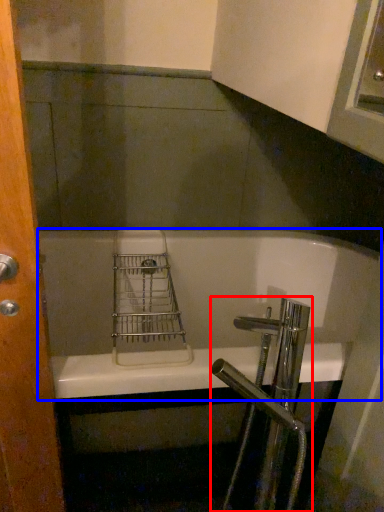
Question: Which point is further to the camera, tap (highlighted by a red box) or bathtub (highlighted by a blue box)?

Choices:
 (A) tap
 (B) bathtub

Answer: (B)